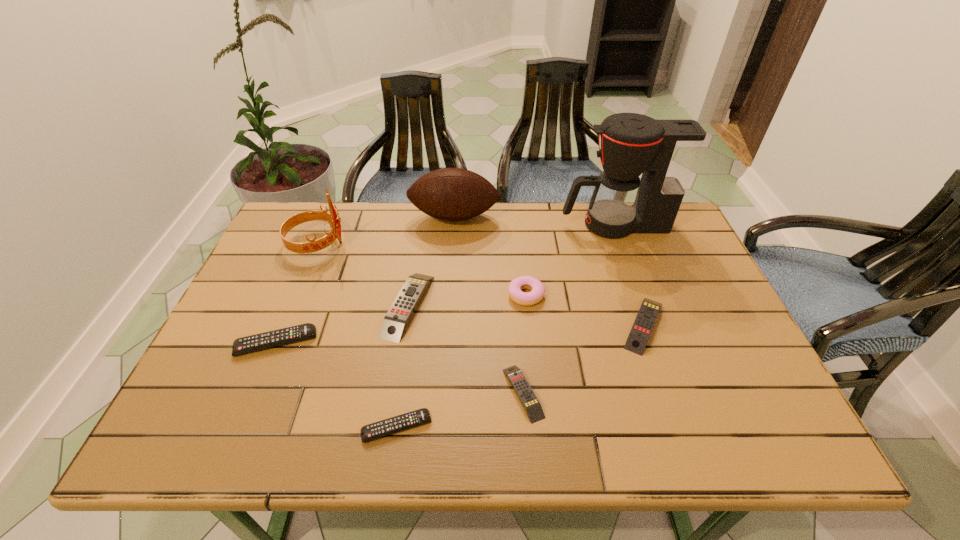
At what (x,y) coordinates should I click in order to perform the action: click on remote control at the left edge. Please return your answer as a coordinate pair (x, y). This screenshot has width=960, height=540. Looking at the image, I should click on (247, 344).

Locate an element on the screen. The width and height of the screenshot is (960, 540). coffee maker that is positioned at the right edge is located at coordinates (665, 152).

What are the coordinates of `remote control at the right edge` in the screenshot? It's located at point(640,332).

The image size is (960, 540). I want to click on object that is at the far left corner, so click(x=332, y=218).

The image size is (960, 540). Find the location of `object located at the far right corner`. object located at the far right corner is located at coordinates (665, 152).

The width and height of the screenshot is (960, 540). Identify the location of free space at the far edge of the desktop. (399, 204).

What are the coordinates of `free space at the near edge of the desktop` in the screenshot? It's located at (368, 411).

Find the location of a particular element. free spot at the left edge of the desktop is located at coordinates (276, 350).

This screenshot has height=540, width=960. I want to click on free space at the near left corner of the desktop, so click(x=227, y=431).

This screenshot has width=960, height=540. What are the coordinates of `free space that is in between the red tiara and the right black remote control` in the screenshot? It's located at (357, 335).